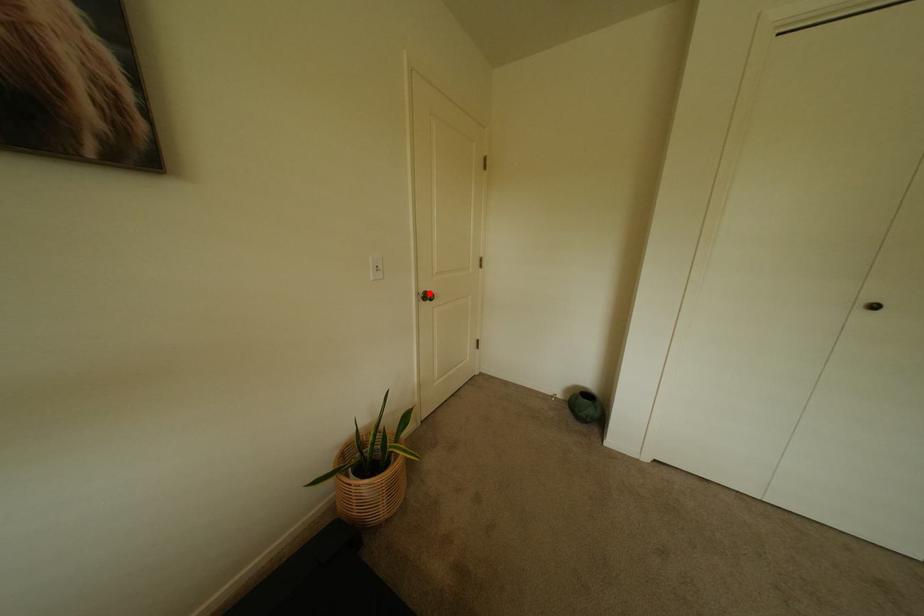
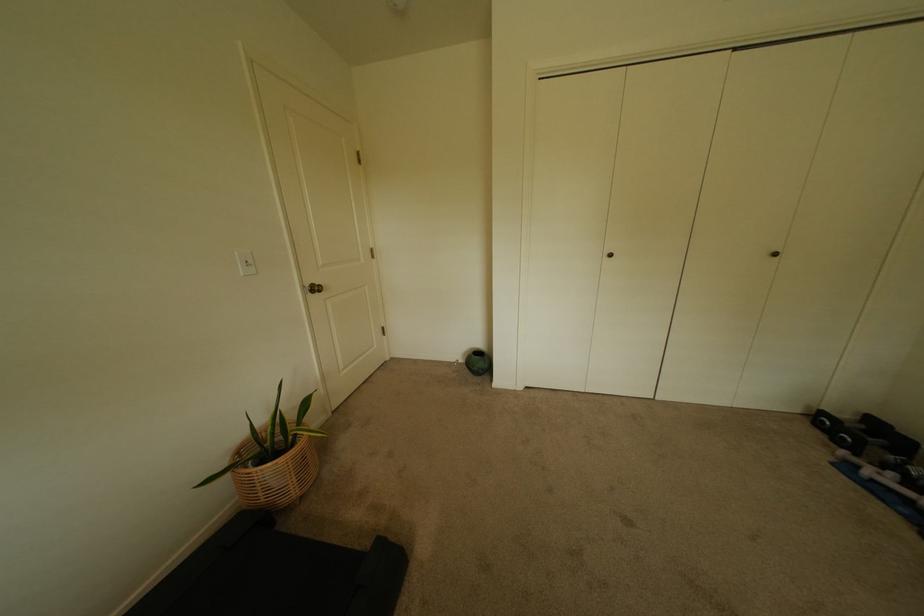
Question: A red point is marked in image1. In image2, is the corresponding 3D point closer to the camera or farther? Reply with the corresponding letter.

Choices:
 (A) The corresponding 3D point is closer.
 (B) The corresponding 3D point is farther.

Answer: (A)